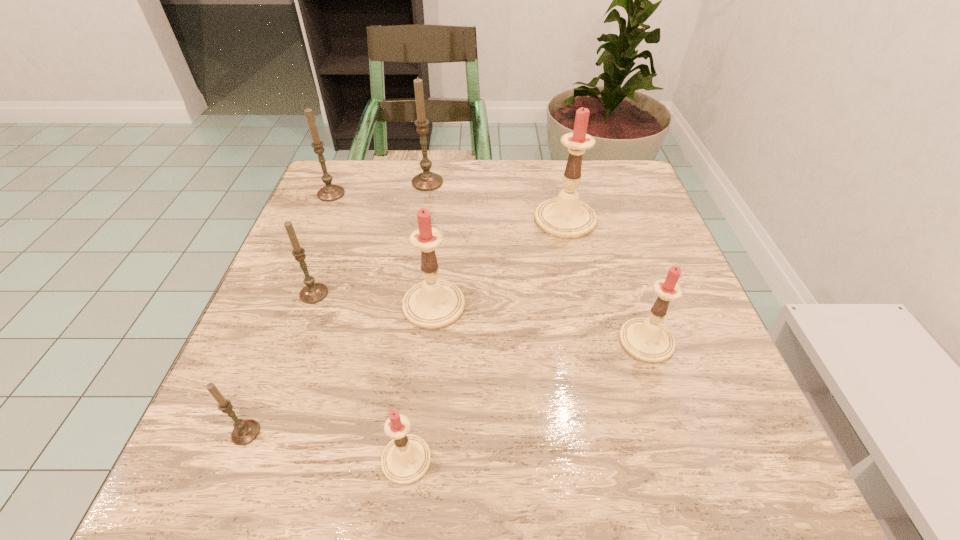
At what (x,y) coordinates should I click in order to perform the action: click on free location at the near edge. Please return your answer as a coordinate pair (x, y). The width and height of the screenshot is (960, 540). Looking at the image, I should click on (498, 462).

Identify the location of free region at the left edge of the desktop. (304, 245).

Locate an element on the screen. The height and width of the screenshot is (540, 960). free point at the right edge is located at coordinates point(630,221).

Locate an element on the screen. The width and height of the screenshot is (960, 540). free space at the far right corner of the desktop is located at coordinates click(x=637, y=202).

Identify the location of blank space at the near right corner of the desktop. The image size is (960, 540). (661, 465).

Locate an element on the screen. vacant point located between the third smallest red candle and the farthest red candle is located at coordinates (x=499, y=262).

Where is `free space between the third smallest red candle and the smallest red candle`? free space between the third smallest red candle and the smallest red candle is located at coordinates (420, 382).

Where is `vacant space that's between the second biggest red candle and the third smallest gray candle`? The width and height of the screenshot is (960, 540). vacant space that's between the second biggest red candle and the third smallest gray candle is located at coordinates (382, 249).

At what (x,y) coordinates should I click in order to perform the action: click on empty space between the smallest gray candle and the third biggest red candle. Please return your answer as a coordinate pair (x, y). This screenshot has width=960, height=540. Looking at the image, I should click on (446, 387).

At what (x,y) coordinates should I click in order to perform the action: click on free space between the second biggest gray candle and the nearest red candle. Please return your answer as a coordinate pair (x, y). The height and width of the screenshot is (540, 960). Looking at the image, I should click on (369, 327).